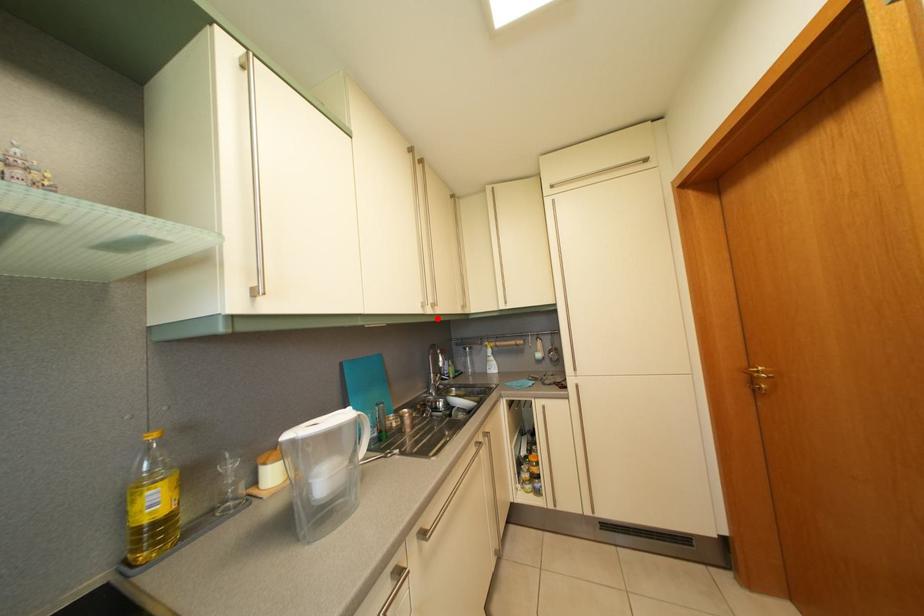
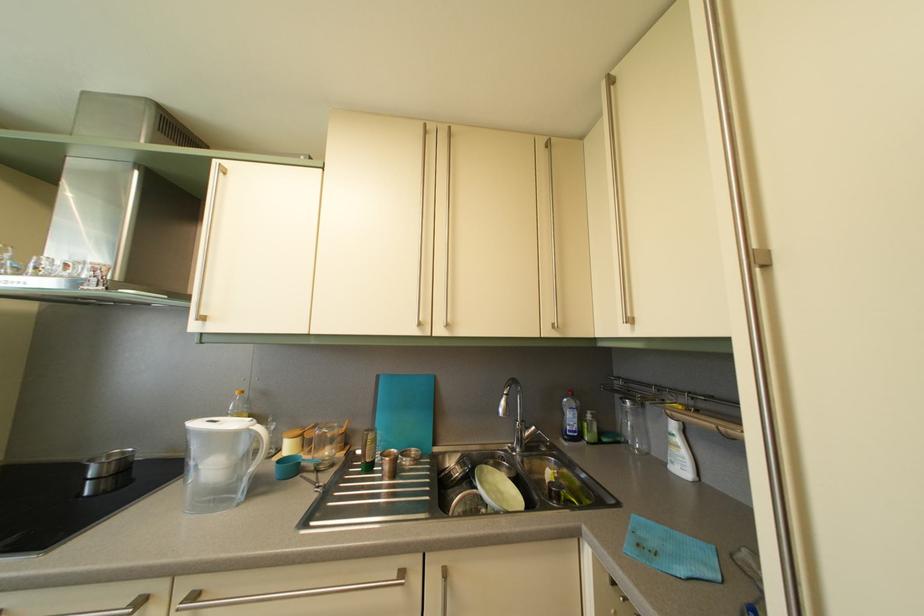
The point at the highlighted location is marked in the first image. Where is the corresponding point in the second image?

(447, 339)